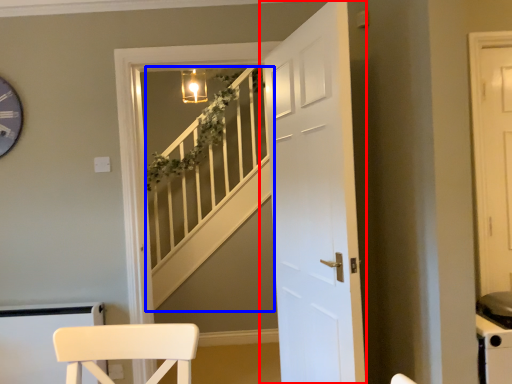
Question: Which of the following is the farthest to the observer, door (highlighted by a red box) or stairwell (highlighted by a blue box)?

Choices:
 (A) door
 (B) stairwell

Answer: (B)